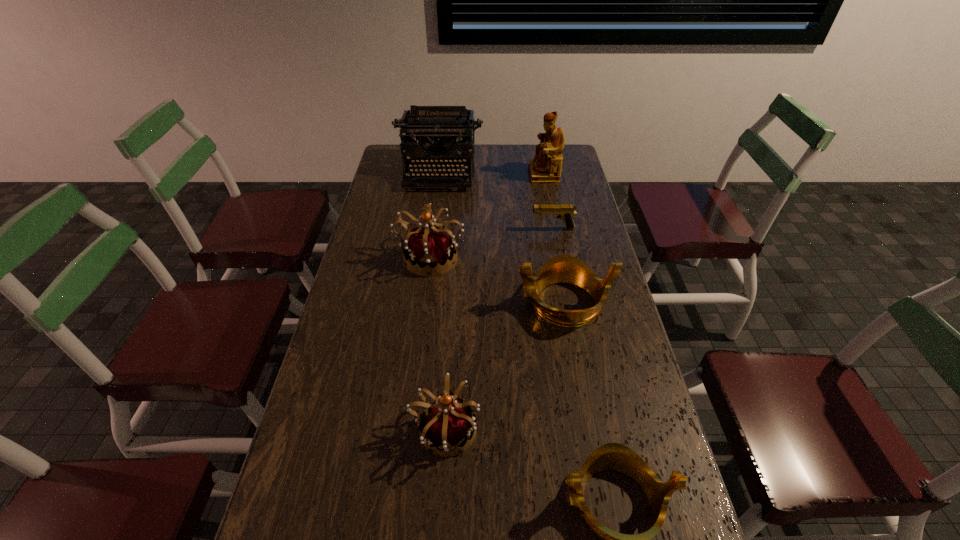
This screenshot has width=960, height=540. What are the coordinates of `figurine that is at the far edge` in the screenshot? It's located at (546, 166).

Find the location of a particular element. This screenshot has width=960, height=540. typewriter at the far edge is located at coordinates (426, 124).

Find the location of a particular element. The width and height of the screenshot is (960, 540). typewriter located at the left edge is located at coordinates (426, 124).

This screenshot has width=960, height=540. What are the coordinates of `tiara that is at the left edge` in the screenshot? It's located at (432, 249).

Image resolution: width=960 pixels, height=540 pixels. In order to click on figurine present at the right edge in this screenshot , I will do `click(546, 166)`.

Identify the location of tiara present at the right edge. The height and width of the screenshot is (540, 960). (563, 268).

At what (x,y) coordinates should I click in order to perform the action: click on pistol located at the right edge. Please return your answer as a coordinate pair (x, y). Image resolution: width=960 pixels, height=540 pixels. Looking at the image, I should click on (565, 212).

At what (x,y) coordinates should I click in order to perform the action: click on object situated at the far left corner. Please return your answer as a coordinate pair (x, y). Looking at the image, I should click on (426, 124).

Where is `object positioned at the far right corner`? object positioned at the far right corner is located at coordinates click(546, 166).

Image resolution: width=960 pixels, height=540 pixels. In the image, there is a desktop. Find the location of `vacant space at the far edge`. vacant space at the far edge is located at coordinates (477, 144).